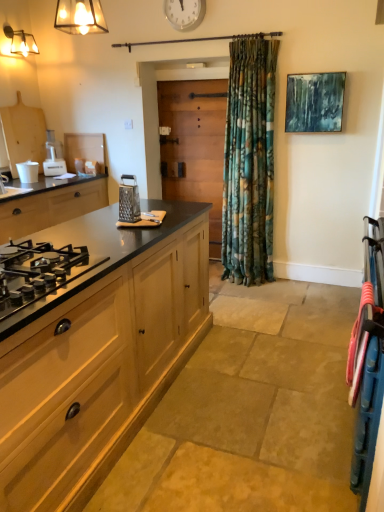
The width and height of the screenshot is (384, 512). I want to click on wooden at center, so click(x=194, y=146).

This screenshot has height=512, width=384. I want to click on white plastic clock at upper center, so click(184, 13).

Locate an element on the screen. The width and height of the screenshot is (384, 512). black glass gas stove at lower left is located at coordinates (39, 272).

Where is `metallic glass light fixture at upper left`? The height and width of the screenshot is (512, 384). metallic glass light fixture at upper left is located at coordinates (20, 42).

Is white plastic clock at upper center not near white plastic food processor at left, which is counted as the second appliance, starting from the front?

Yes, white plastic clock at upper center and white plastic food processor at left, which is counted as the second appliance, starting from the front, are quite far apart.

Could you tell me if white plastic clock at upper center is facing white plastic food processor at left, which appears as the 1th appliance when viewed from the back?

No, white plastic clock at upper center is not aimed at white plastic food processor at left, which appears as the 1th appliance when viewed from the back.

Which is more to the left, white plastic clock at upper center or white plastic food processor at left, the second appliance in the bottom-to-top sequence?

Positioned to the left is white plastic food processor at left, the second appliance in the bottom-to-top sequence.

In the image, is white plastic clock at upper center positioned in front of or behind white plastic food processor at left, the second appliance in the bottom-to-top sequence?

Clearly, white plastic clock at upper center is in front of white plastic food processor at left, the second appliance in the bottom-to-top sequence.

From the image's perspective, does white matte cup at left, positioned as the second appliance in top-to-bottom order, appear lower than metallic grater at center?

No.

Is white matte cup at left, positioned as the second appliance in top-to-bottom order, in contact with metallic grater at center?

There is a gap between white matte cup at left, positioned as the second appliance in top-to-bottom order, and metallic grater at center.

Which object is thinner, white matte cup at left, which ranks as the second appliance in back-to-front order, or metallic grater at center?

Thinner between the two is metallic grater at center.

Is white matte cup at left, arranged as the 1th appliance when viewed from the front, at the left side of metallic grater at center?

Yes.

Considering the relative sizes of metallic grater at center and wooden at center in the image provided, is metallic grater at center smaller than wooden at center?

Indeed, metallic grater at center has a smaller size compared to wooden at center.

From a real-world perspective, does metallic grater at center sit lower than wooden at center?

Incorrect, from a real-world perspective, metallic grater at center is higher than wooden at center.

Consider the image. Considering the positions of objects metallic grater at center and wooden at center in the image provided, who is behind, metallic grater at center or wooden at center?

wooden at center is further from the camera.

Which object is positioned more to the right, metallic grater at center or wooden at center?

wooden at center.

Can you confirm if wooden at center is wider than metallic grater at center?

No, wooden at center is not wider than metallic grater at center.

Would you say wooden at center is inside or outside metallic grater at center?

wooden at center cannot be found inside metallic grater at center.

Is wooden at center positioned with its back to metallic grater at center?

No, wooden at center's orientation is not away from metallic grater at center.

Which point is more distant from viewer, [192,109] or [136,186]?

The point [192,109] is farther.

Can you tell me how much metallic grater at center and black glass gas stove at lower left differ in facing direction?

The angular difference between metallic grater at center and black glass gas stove at lower left is 0.478 degrees.

Which is farther, (126, 205) or (74, 255)?

Point (126, 205)

Is metallic grater at center touching black glass gas stove at lower left?

There is a gap between metallic grater at center and black glass gas stove at lower left.

Identify the location of gas stove that appears below the metallic grater at center (from a real-world perspective). The height and width of the screenshot is (512, 384). (39, 272).

Locate an element on the screen. The width and height of the screenshot is (384, 512). clock above the metallic grater at center (from a real-world perspective) is located at coordinates (184, 13).

Considering the sizes of objects metallic grater at center and white plastic clock at upper center in the image provided, who is bigger, metallic grater at center or white plastic clock at upper center?

white plastic clock at upper center is bigger.

How many degrees apart are the facing directions of metallic grater at center and white plastic clock at upper center?

The angle between the facing direction of metallic grater at center and the facing direction of white plastic clock at upper center is 89.8 degrees.

Can you confirm if wooden at center is bigger than black glass gas stove at lower left?

Yes, wooden at center is bigger than black glass gas stove at lower left.

Is wooden at center next to black glass gas stove at lower left?

No, wooden at center is not next to black glass gas stove at lower left.

Is wooden at center closer to the viewer compared to black glass gas stove at lower left?

No, the depth of wooden at center is greater than that of black glass gas stove at lower left.

How far apart are wooden at center and black glass gas stove at lower left?

wooden at center is 9.33 feet away from black glass gas stove at lower left.

This screenshot has height=512, width=384. I want to click on clock in front of the white plastic food processor at left, the 1th appliance positioned from the top, so click(184, 13).

From the metallic grater at center, count the 2nd appliance to the left and point to it. Please provide its 2D coordinates.

[(28, 170)]

Looking at this image, based on their spatial positions, is white plastic clock at upper center or metallic grater at center closer to black matte gas stove at left, marked as the second cabinetry in a bottom-to-top arrangement?

Based on the image, metallic grater at center appears to be nearer to black matte gas stove at left, marked as the second cabinetry in a bottom-to-top arrangement.

Looking at the image, which one is located further to black glass gas stove at lower left, black matte gas stove at left, the first cabinetry viewed from the left, or white matte cup at left, placed as the first appliance when sorted from bottom to top?

white matte cup at left, placed as the first appliance when sorted from bottom to top, is positioned further to the anchor black glass gas stove at lower left.

Estimate the real-world distances between objects in this image. Which object is closer to metallic glass light fixture at upper left, black glass gas stove at lower left or wooden cabinet at left, placed as the 2th cabinetry when sorted from left to right?

The object closer to metallic glass light fixture at upper left is wooden cabinet at left, placed as the 2th cabinetry when sorted from left to right.

Based on their spatial positions, is wooden at center or wooden cabinet at left, which appears as the first cabinetry when viewed from the right, further from black matte gas stove at left, marked as the second cabinetry in a bottom-to-top arrangement?

wooden cabinet at left, which appears as the first cabinetry when viewed from the right.

Looking at the image, which one is located closer to wooden at center, black matte gas stove at left, the 1th cabinetry in the top-to-bottom sequence, or black glass gas stove at lower left?

black matte gas stove at left, the 1th cabinetry in the top-to-bottom sequence, is positioned closer to the anchor wooden at center.

Estimate the real-world distances between objects in this image. Which object is closer to wooden at center, black glass gas stove at lower left or wooden cabinet at left, which appears as the first cabinetry when viewed from the right?

Based on the image, wooden cabinet at left, which appears as the first cabinetry when viewed from the right, appears to be nearer to wooden at center.

When comparing their distances from white plastic food processor at left, which appears as the 1th appliance when viewed from the back, does black matte gas stove at left, the 1th cabinetry in the top-to-bottom sequence, or wooden at center seem closer?

black matte gas stove at left, the 1th cabinetry in the top-to-bottom sequence, lies closer to white plastic food processor at left, which appears as the 1th appliance when viewed from the back, than the other object.

Estimate the real-world distances between objects in this image. Which object is further from white plastic food processor at left, the 1th appliance positioned from the top, black glass gas stove at lower left or wooden at center?

Based on the image, black glass gas stove at lower left appears to be further to white plastic food processor at left, the 1th appliance positioned from the top.

The height and width of the screenshot is (512, 384). What are the coordinates of `cabinetry between metallic glass light fixture at upper left and wooden at center in the horizontal direction` in the screenshot? It's located at (50, 208).

You are a GUI agent. You are given a task and a screenshot of the screen. Output one action in this format:
    pyautogui.click(x=<x>, y=<y>)
    Task: Click on the clock between black glass gas stove at lower left and metallic glass light fixture at upper left along the z-axis
    
    Given the screenshot: What is the action you would take?
    pyautogui.click(x=184, y=13)

The height and width of the screenshot is (512, 384). I want to click on cabinetry between metallic glass light fixture at upper left and wooden cabinet at left, the first cabinetry positioned from the bottom, vertically, so click(50, 208).

Where is `light fixture between black glass gas stove at lower left and white plastic food processor at left, the 1th appliance positioned from the top, along the z-axis`? Image resolution: width=384 pixels, height=512 pixels. light fixture between black glass gas stove at lower left and white plastic food processor at left, the 1th appliance positioned from the top, along the z-axis is located at coordinates (20, 42).